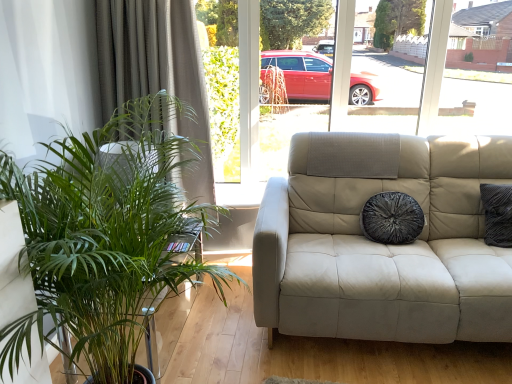
Question: Based on their positions, is velvety black pillow at center located to the left or right of green leafy plant at left?

Choices:
 (A) left
 (B) right

Answer: (B)

Question: In the image, is velvety black pillow at center positioned in front of or behind green leafy plant at left?

Choices:
 (A) front
 (B) behind

Answer: (B)

Question: Which object is the farthest from the green leafy plant at left?

Choices:
 (A) velvety black pillow at center
 (B) green fabric curtain at left

Answer: (A)

Question: Estimate the real-world distances between objects in this image. Which object is closer to the green leafy plant at left?

Choices:
 (A) green fabric curtain at left
 (B) velvety black pillow at center

Answer: (A)